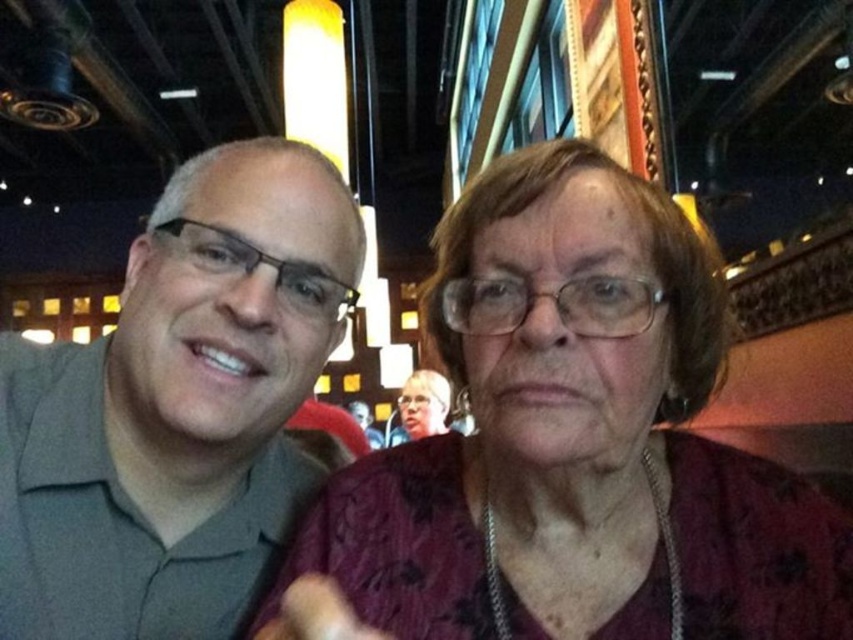
You are a photographer setting up for a group photo. You have to position the maroon fabric dress at center and the gray matte shirt at left so that both are visible in the frame. Considering their heights, which object should you adjust to ensure both are fully visible?

The maroon fabric dress at center is not as tall as the gray matte shirt at left, so you should adjust the camera angle or position to ensure the shorter maroon fabric dress at center is visible without being blocked by the taller gray matte shirt at left.

You are a photographer setting up for a group photo. You notice two clothing items in the scene that might interfere with the background. The maroon fabric dress at center and the matte purple blouse at center are both at the center. Since they are both at the center, how far apart are they from each other?

The maroon fabric dress at center and the matte purple blouse at center are 2.87 meters apart from each other.